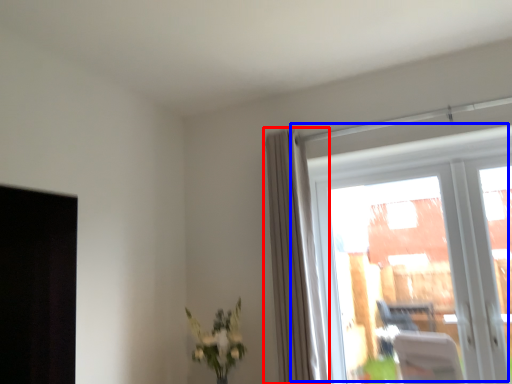
Question: Which of the following is the closest to the observer, curtain (highlighted by a red box) or window (highlighted by a blue box)?

Choices:
 (A) curtain
 (B) window

Answer: (B)